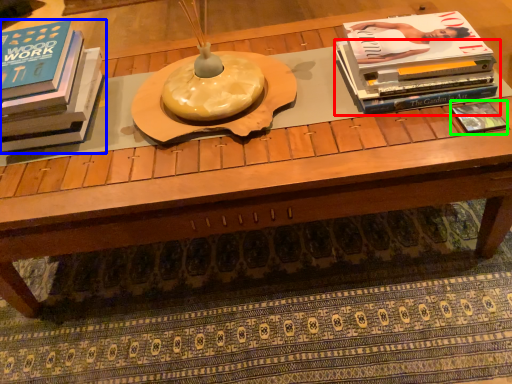
Question: Estimate the real-world distances between objects in this image. Which object is farther from book (highlighted by a red box), book (highlighted by a blue box) or book (highlighted by a green box)?

Choices:
 (A) book
 (B) book

Answer: (A)